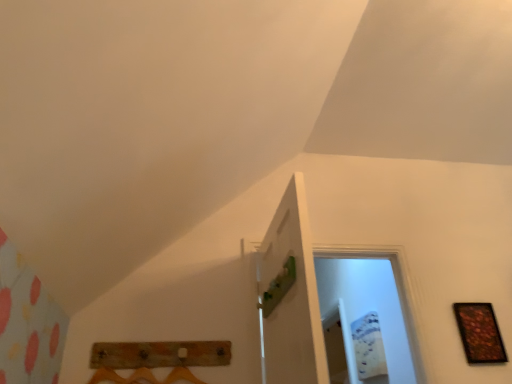
The height and width of the screenshot is (384, 512). Find the location of `rustic wood coat rack at lower center`. rustic wood coat rack at lower center is located at coordinates point(155,360).

What do you see at coordinates (479, 333) in the screenshot?
I see `wooden picture frame at right` at bounding box center [479, 333].

In order to face green matte door at center, should I rotate leftwards or rightwards?

Rotate your view right by about 3.389°.

You are a GUI agent. You are given a task and a screenshot of the screen. Output one action in this format:
    pyautogui.click(x=<x>, y=<y>)
    Task: Click on the rustic wood coat rack at lower center
    Image resolution: width=512 pixels, height=384 pixels.
    Given the screenshot: What is the action you would take?
    pyautogui.click(x=155, y=360)

From the image's perspective, is wooden picture frame at right under rustic wood coat rack at lower center?

Indeed, from the image's perspective, wooden picture frame at right is shown beneath rustic wood coat rack at lower center.

Can we say wooden picture frame at right lies outside rustic wood coat rack at lower center?

Indeed, wooden picture frame at right is completely outside rustic wood coat rack at lower center.

Which object is further away from the camera, wooden picture frame at right or rustic wood coat rack at lower center?

→ wooden picture frame at right is further away from the camera.

Considering the positions of point (472, 303) and point (221, 354), is point (472, 303) closer or farther from the camera than point (221, 354)?

Point (472, 303).

Is the surface of rustic wood coat rack at lower center in direct contact with green matte door at center?

No, rustic wood coat rack at lower center is not making contact with green matte door at center.

Which is correct: rustic wood coat rack at lower center is inside green matte door at center, or outside of it?

rustic wood coat rack at lower center lies outside green matte door at center.

Can you confirm if rustic wood coat rack at lower center is smaller than green matte door at center?

Correct, rustic wood coat rack at lower center occupies less space than green matte door at center.

In the image, is rustic wood coat rack at lower center on the left side or the right side of green matte door at center?

rustic wood coat rack at lower center is positioned on green matte door at center's left side.

Which object is thinner, green matte door at center or wooden picture frame at right?

Thinner between the two is wooden picture frame at right.

Does green matte door at center turn towards wooden picture frame at right?

Yes, green matte door at center is facing wooden picture frame at right.

Does green matte door at center appear on the left side of wooden picture frame at right?

Indeed, green matte door at center is positioned on the left side of wooden picture frame at right.

Between wooden picture frame at right and green matte door at center, which one has less height?

With less height is wooden picture frame at right.

Considering the sizes of wooden picture frame at right and green matte door at center in the image, is wooden picture frame at right bigger or smaller than green matte door at center?

wooden picture frame at right is smaller than green matte door at center.

Considering the positions of objects wooden picture frame at right and green matte door at center in the image provided, who is more to the right, wooden picture frame at right or green matte door at center?

Positioned to the right is wooden picture frame at right.

From the image's perspective, which one is positioned higher, wooden picture frame at right or green matte door at center?

green matte door at center.

How different are the orientations of rustic wood coat rack at lower center and wooden picture frame at right in degrees?

rustic wood coat rack at lower center and wooden picture frame at right are facing 2.82 degrees away from each other.

Can we say rustic wood coat rack at lower center lies outside wooden picture frame at right?

Yes.

Is rustic wood coat rack at lower center not near wooden picture frame at right?

Yes, rustic wood coat rack at lower center and wooden picture frame at right are quite far apart.

Considering the positions of points (206, 347) and (492, 332), is point (206, 347) closer to camera compared to point (492, 332)?

Yes, it is.

From a real-world perspective, is green matte door at center physically located above or below rustic wood coat rack at lower center?

In terms of real-world spatial position, green matte door at center is above rustic wood coat rack at lower center.

Can you confirm if green matte door at center is wider than rustic wood coat rack at lower center?

Yes, green matte door at center is wider than rustic wood coat rack at lower center.

Which is closer to the camera, (x=315, y=327) or (x=166, y=379)?

The point (x=315, y=327) is closer to the camera.

Could you tell me if green matte door at center is turned towards rustic wood coat rack at lower center?

No.

At what (x,y) coordinates should I click in order to perform the action: click on furniture on the left of wooden picture frame at right. Please return your answer as a coordinate pair (x, y). This screenshot has width=512, height=384. Looking at the image, I should click on (155, 360).

Locate an element on the screen. The image size is (512, 384). door lying above the rustic wood coat rack at lower center (from the image's perspective) is located at coordinates (290, 296).

Considering their positions, is rustic wood coat rack at lower center positioned further to wooden picture frame at right than green matte door at center?

Based on the image, rustic wood coat rack at lower center appears to be further to wooden picture frame at right.

When comparing their distances from rustic wood coat rack at lower center, does wooden picture frame at right or green matte door at center seem further?

wooden picture frame at right.

Considering their positions, is green matte door at center positioned further to rustic wood coat rack at lower center than wooden picture frame at right?

wooden picture frame at right lies further to rustic wood coat rack at lower center than the other object.

Considering their positions, is green matte door at center positioned closer to wooden picture frame at right than rustic wood coat rack at lower center?

green matte door at center.

Estimate the real-world distances between objects in this image. Which object is closer to green matte door at center, wooden picture frame at right or rustic wood coat rack at lower center?

rustic wood coat rack at lower center is closer to green matte door at center.

Estimate the real-world distances between objects in this image. Which object is further from green matte door at center, rustic wood coat rack at lower center or wooden picture frame at right?

wooden picture frame at right.

This screenshot has height=384, width=512. What are the coordinates of `door situated between rustic wood coat rack at lower center and wooden picture frame at right from left to right` in the screenshot? It's located at (290, 296).